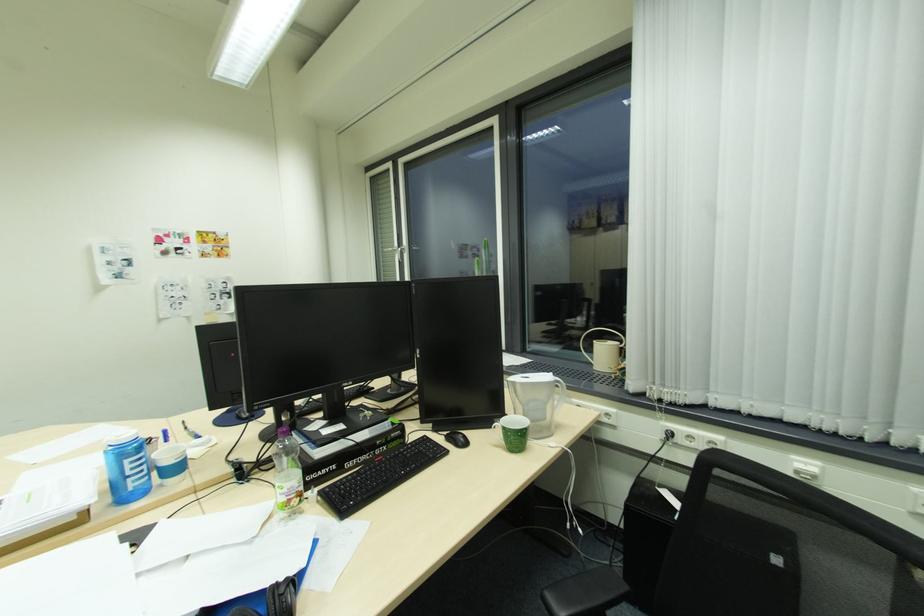
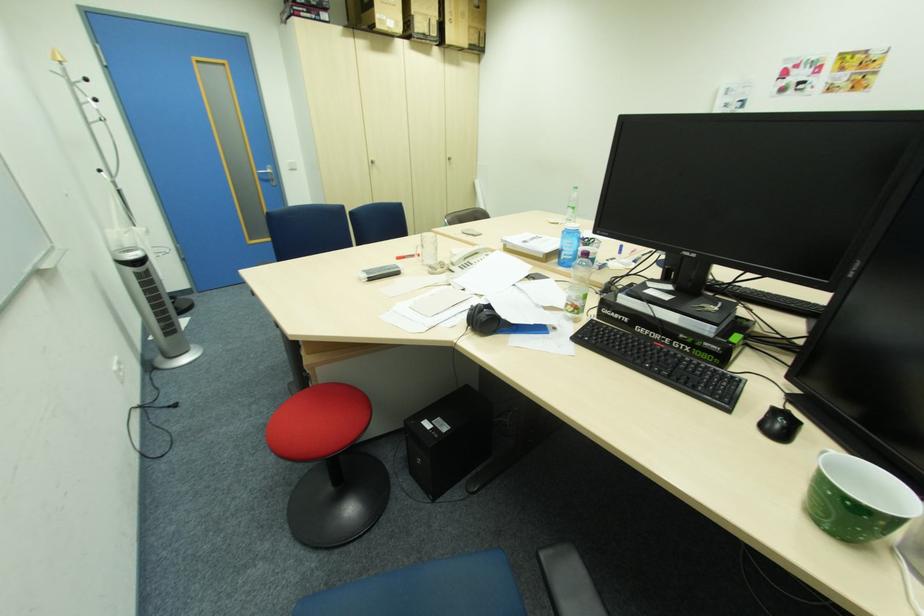
How did the camera likely rotate?

The rotation direction of the camera is left-down.